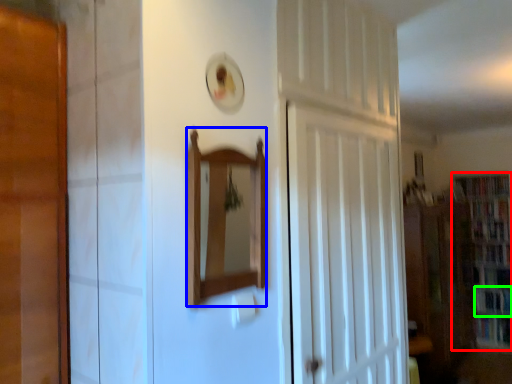
Question: Which object is the closest to the bookcase (highlighted by a red box)? Choose among these: mirror (highlighted by a blue box) or book (highlighted by a green box).

Choices:
 (A) mirror
 (B) book

Answer: (B)